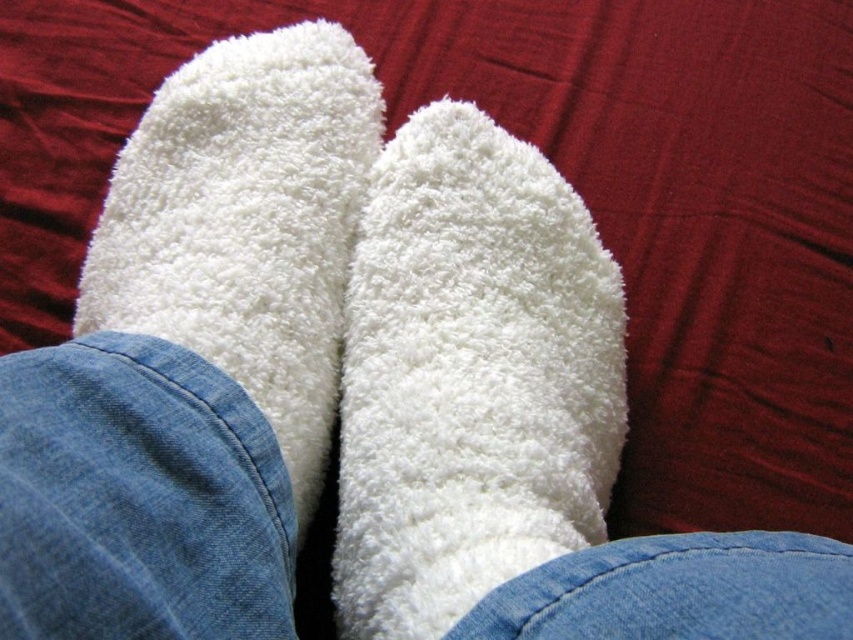
Between white fluffy sock at center and white fluffy socks at center, which one is positioned lower?

Positioned lower is white fluffy sock at center.

Can you confirm if white fluffy sock at center is positioned to the left of white fluffy socks at center?

In fact, white fluffy sock at center is to the right of white fluffy socks at center.

Who is more distant from viewer, (548, 468) or (158, 211)?

Point (158, 211)

The image size is (853, 640). I want to click on white fluffy sock at center, so click(x=469, y=378).